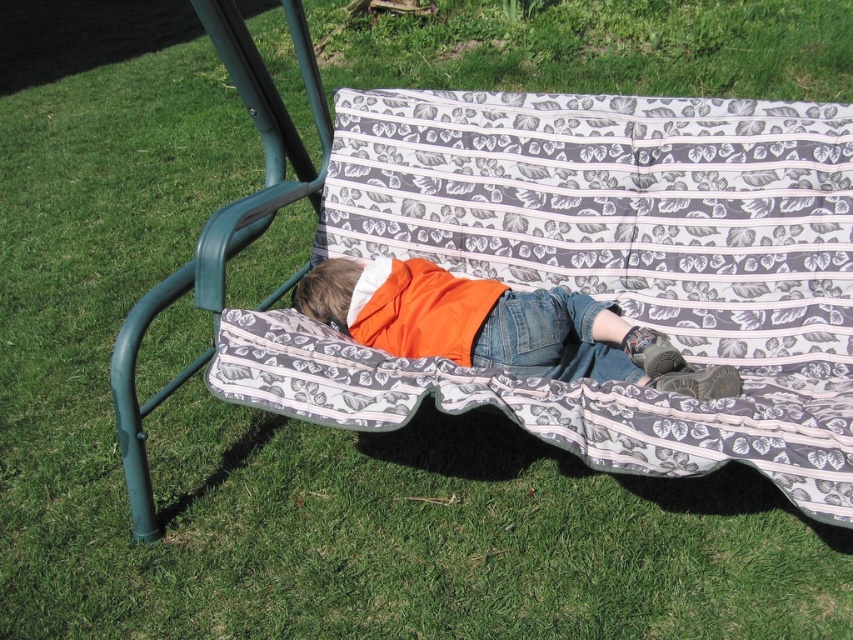
You are a photographer trying to capture a closeup of the orange fabric shirt at center. The patterned fabric blanket at center is in the way. Can you adjust your position to focus on the shirt without moving the blanket?

The patterned fabric blanket at center is closer to the viewer than the orange fabric shirt at center, so you would need to move your camera position to focus on the shirt behind the blanket.

You are a photographer trying to capture a closeup of the orange fabric shirt at center while ensuring the patterned fabric blanket at center is still visible in the frame. Given that your camera has a minimum focus distance of 25 centimeters, will you be able to achieve this shot?

The patterned fabric blanket at center and orange fabric shirt at center are 26.63 centimeters apart from each other. Since the minimum focus distance is 25 centimeters, you can achieve the closeup shot while keeping both the orange fabric shirt at center and the patterned fabric blanket at center in the frame.

You are a photographer standing 1.5 meters away from the camera position. You want to adjust your position so that you can clearly see the patterned fabric blanket at center without moving the camera. Should you move closer or farther away from the camera?

The patterned fabric blanket at center is currently 1.54 meters away from the camera. Since you are standing 1.5 meters away from the camera position, you should move slightly closer to the camera to ensure you are positioned between the camera and the blanket, allowing you to see it clearly without obstruction.